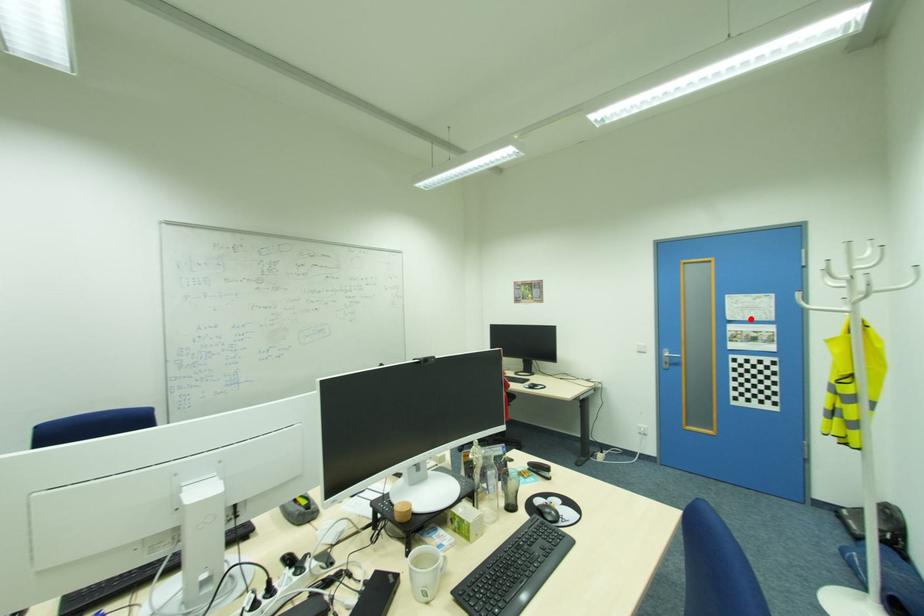
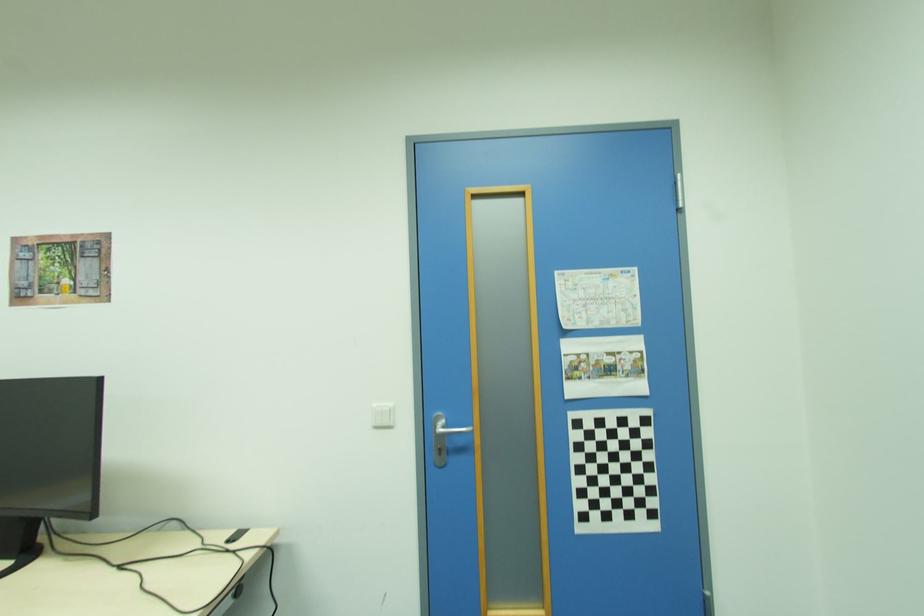
Where in the second image is the point corresponding to the highlighted location from the first image?

(599, 325)